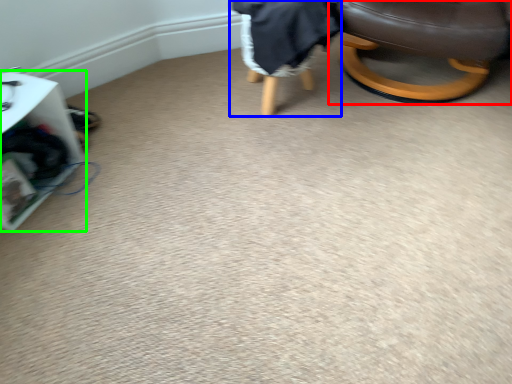
Question: Which is nearer to the chair (highlighted by a red box)? bean bag chair (highlighted by a blue box) or furniture (highlighted by a green box).

Choices:
 (A) bean bag chair
 (B) furniture

Answer: (A)